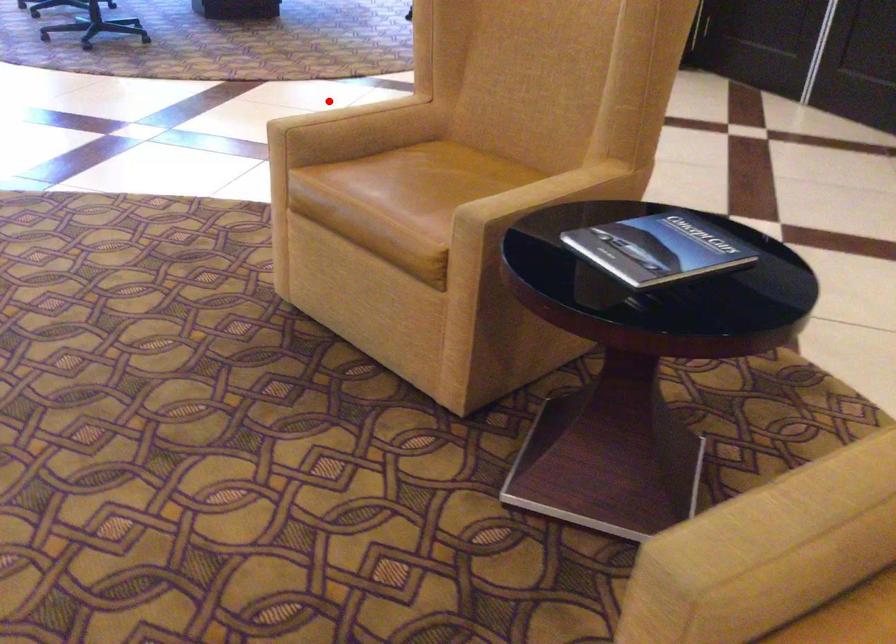
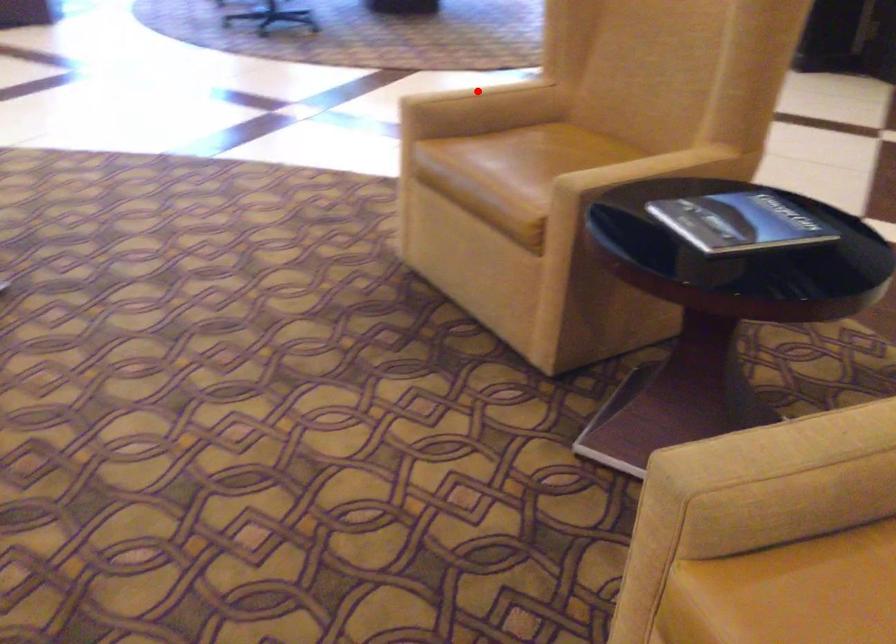
I am providing you with two images of the same scene from different viewpoints. A red point is marked on the first image and another point is marked on the second image. Are the points marked in image1 and image2 representing the same 3D position?

Yes